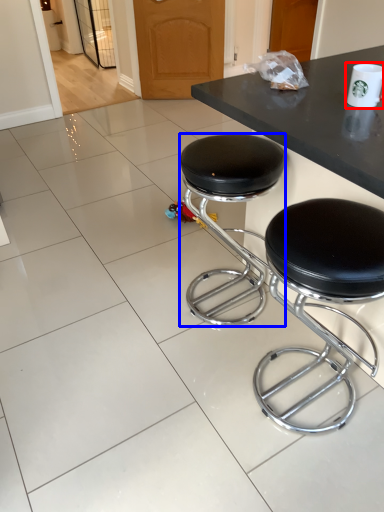
Question: Which object appears farthest to the camera in this image, paper cup (highlighted by a red box) or stool (highlighted by a blue box)?

Choices:
 (A) paper cup
 (B) stool

Answer: (B)